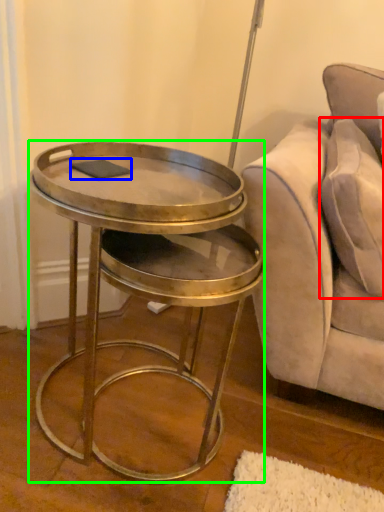
Question: Which object is the closest to the pillow (highlighted by a red box)? Choose among these: pad (highlighted by a blue box) or table (highlighted by a green box).

Choices:
 (A) pad
 (B) table

Answer: (B)